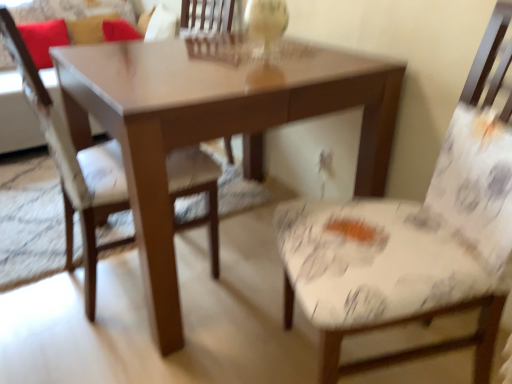
The width and height of the screenshot is (512, 384). I want to click on free spot in front of patterned fabric chair at left, the 2th chair viewed from the right, so click(106, 348).